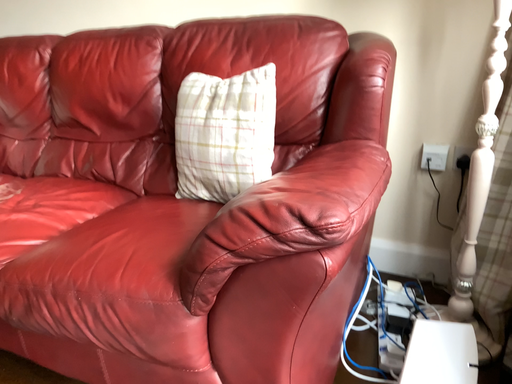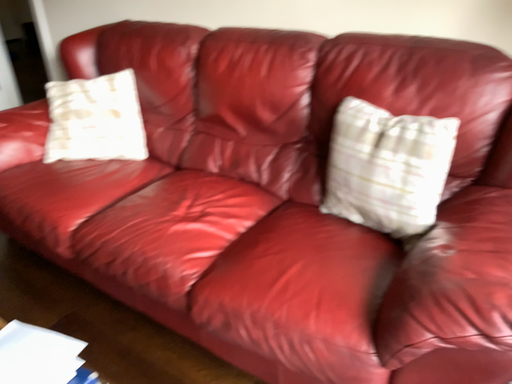
Question: Which way did the camera rotate in the video?

Choices:
 (A) rotated downward
 (B) rotated upward

Answer: (A)